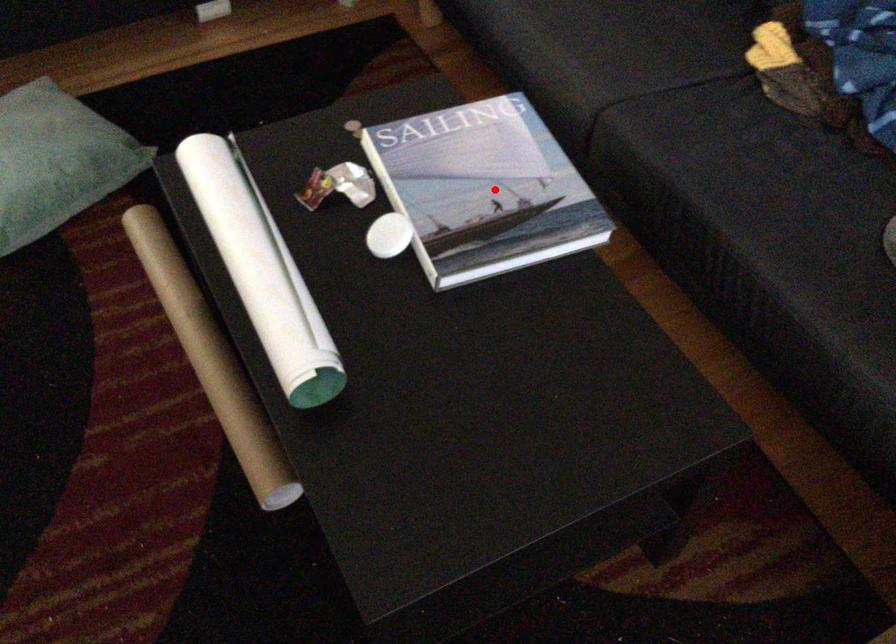
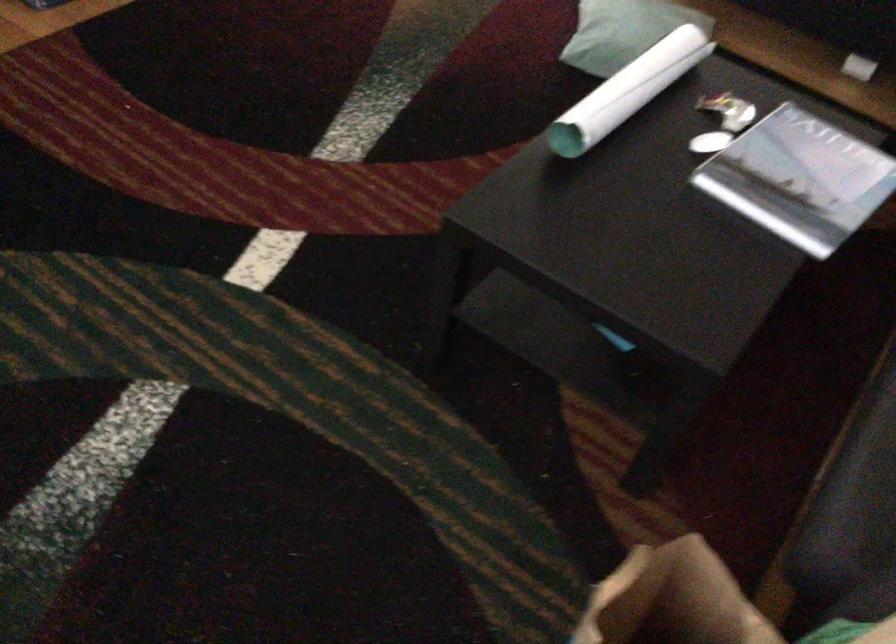
Question: I am providing you with two images of the same scene from different viewpoints. In image1, a red point is highlighted. Considering the same 3D point in image2, which of the following is correct?

Choices:
 (A) It is closer
 (B) It is farther

Answer: (B)